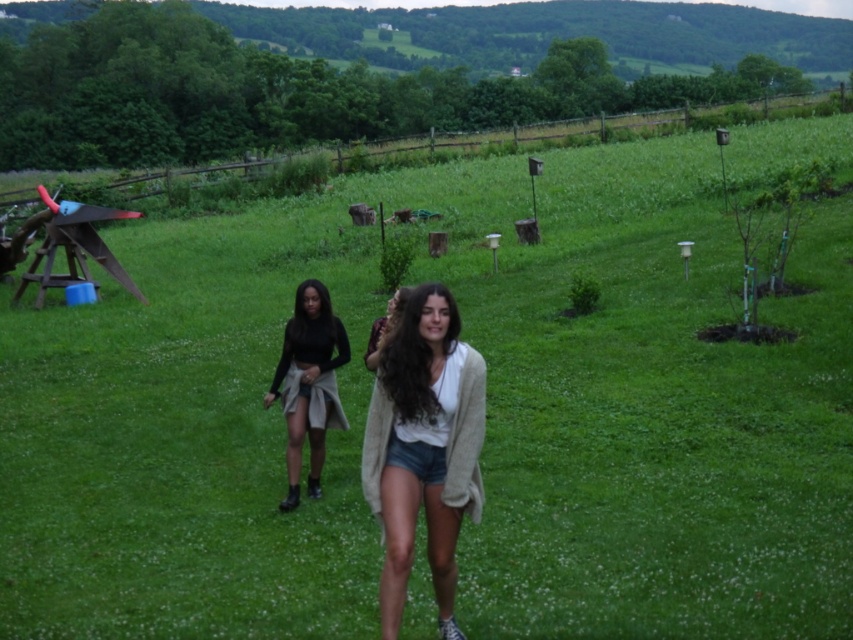
You are a fashion designer observing two outfits in the image. The light beige sweater at center and the matte black top at center are both in the same location. Which one appears bigger?

The light beige sweater at center appears bigger than the matte black top at center as it has a larger size.